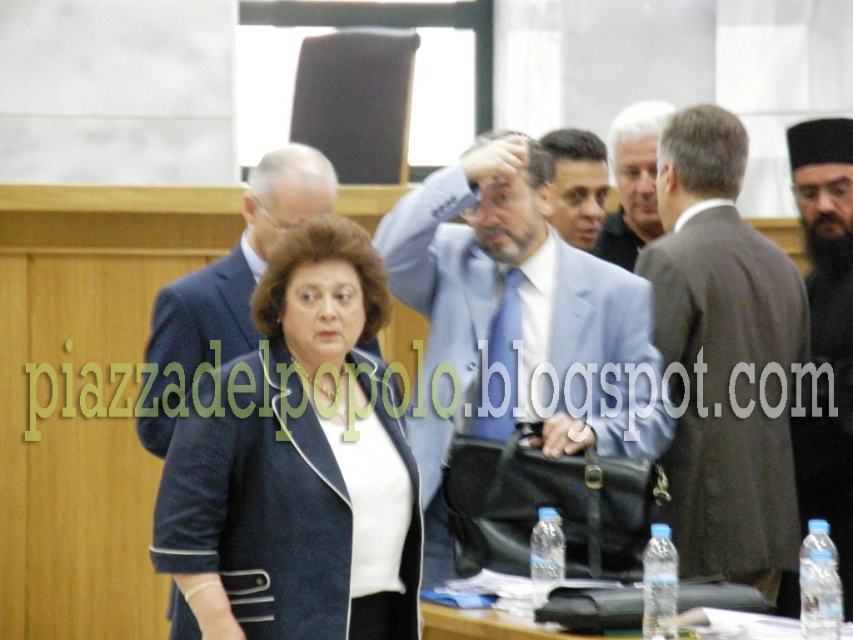
Is point (804, 326) positioned in front of point (635, 170)?

Yes.

Is dark brown suit at center shorter than blue fabric suit at center?

No, dark brown suit at center is not shorter than blue fabric suit at center.

Is point (781, 508) closer to viewer compared to point (631, 186)?

Yes, point (781, 508) is in front of point (631, 186).

The height and width of the screenshot is (640, 853). Find the location of `dark brown suit at center`. dark brown suit at center is located at coordinates (723, 358).

Looking at this image, is matte blue blazer at center thinner than clear plastic water bottles at lower center?

Correct, matte blue blazer at center's width is less than clear plastic water bottles at lower center's.

Is the position of matte blue blazer at center more distant than that of clear plastic water bottles at lower center?

Yes, matte blue blazer at center is behind clear plastic water bottles at lower center.

Which is in front, point (183, 516) or point (498, 586)?

Positioned in front is point (498, 586).

Where is `matte blue blazer at center`? matte blue blazer at center is located at coordinates (294, 468).

The height and width of the screenshot is (640, 853). What do you see at coordinates (723, 358) in the screenshot?
I see `dark brown suit at center` at bounding box center [723, 358].

Does point (682, 125) come behind point (833, 467)?

No, (682, 125) is in front of (833, 467).

Between point (694, 451) and point (839, 253), which one is positioned behind?

The point (839, 253) is behind.

Locate an element on the screen. The width and height of the screenshot is (853, 640). dark brown suit at center is located at coordinates (723, 358).